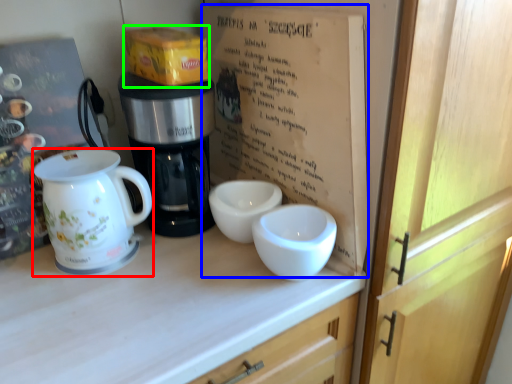
Question: Based on their relative distances, which object is nearer to jug (highlighted by a red box)? Choose from book (highlighted by a blue box) and cardboard box (highlighted by a green box).

Choices:
 (A) book
 (B) cardboard box

Answer: (B)